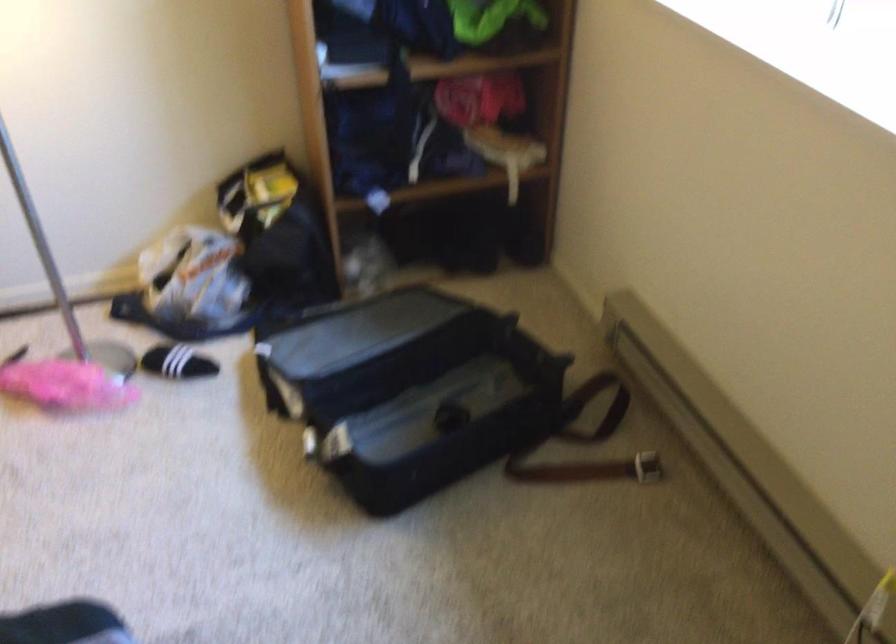
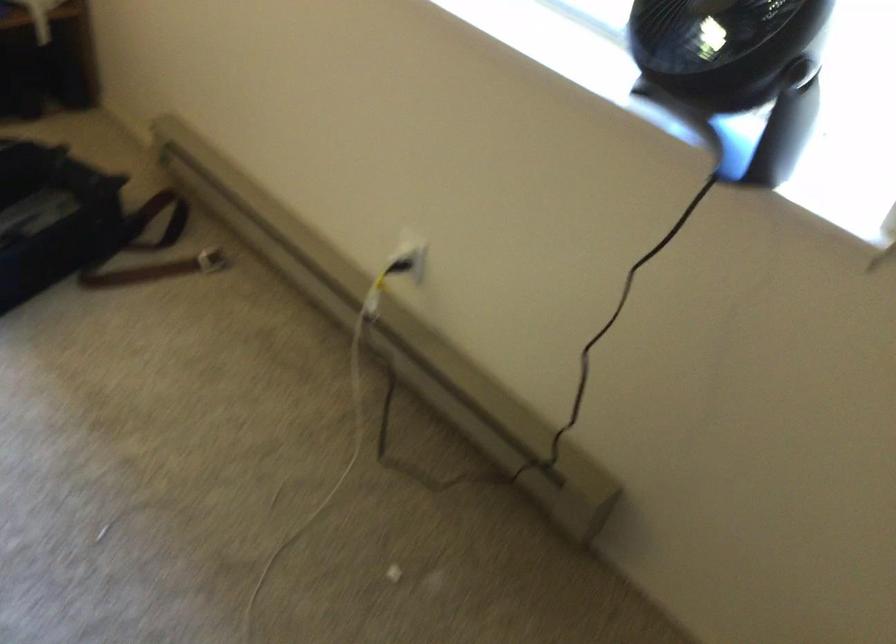
Question: How did the camera likely rotate?

Choices:
 (A) Left
 (B) Right
 (C) Up
 (D) Down

Answer: (B)